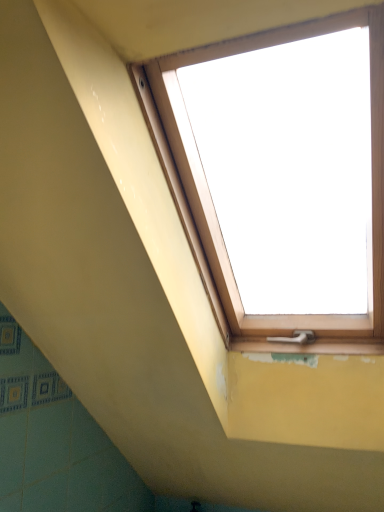
Identify the location of wooden window at upper center. This screenshot has width=384, height=512. (281, 178).

The image size is (384, 512). What do you see at coordinates (281, 178) in the screenshot? I see `wooden window at upper center` at bounding box center [281, 178].

The height and width of the screenshot is (512, 384). Find the location of `wooden window at upper center`. wooden window at upper center is located at coordinates (281, 178).